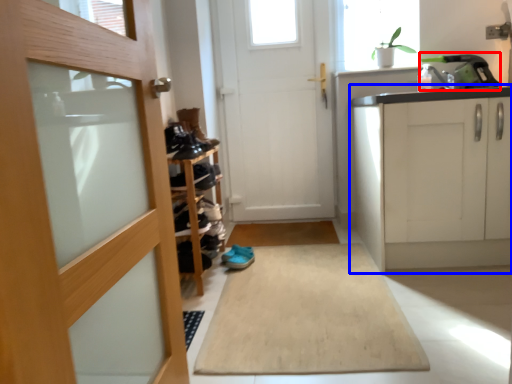
Question: Which object appears closest to the camera in this image, sink (highlighted by a red box) or cabinetry (highlighted by a blue box)?

Choices:
 (A) sink
 (B) cabinetry

Answer: (B)